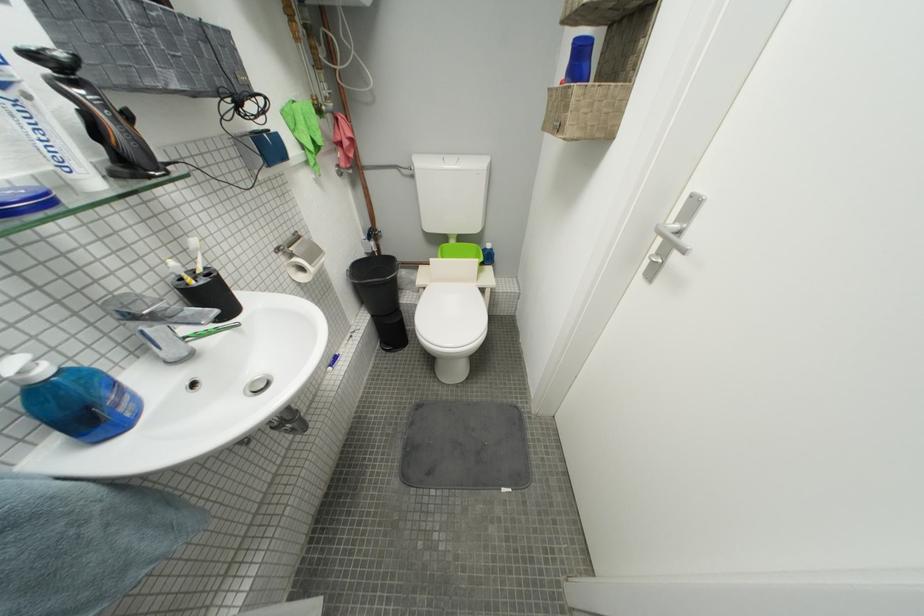
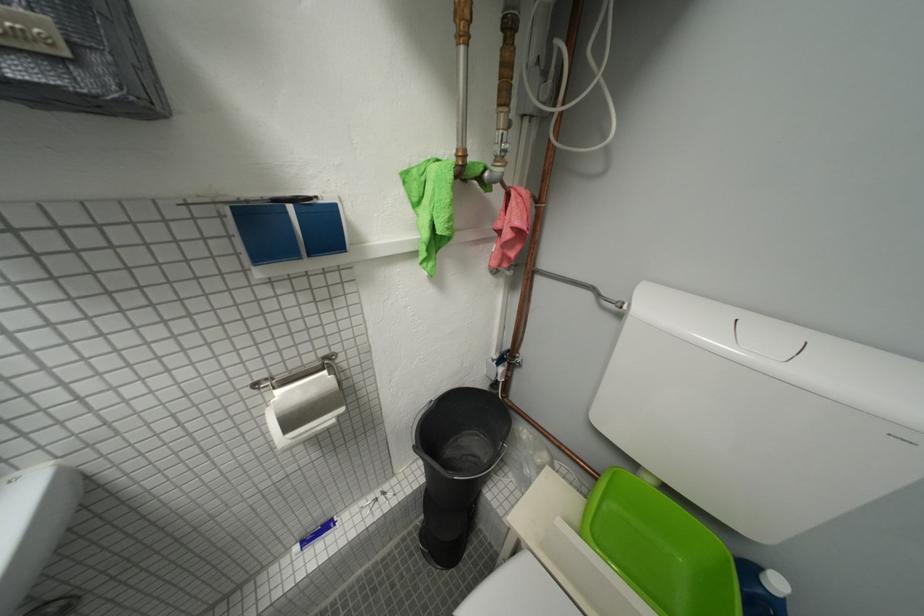
Question: Based on the continuous images, in which direction is the camera rotating? Reply with the corresponding letter.

Choices:
 (A) Left
 (B) Right
 (C) Up
 (D) Down

Answer: (A)